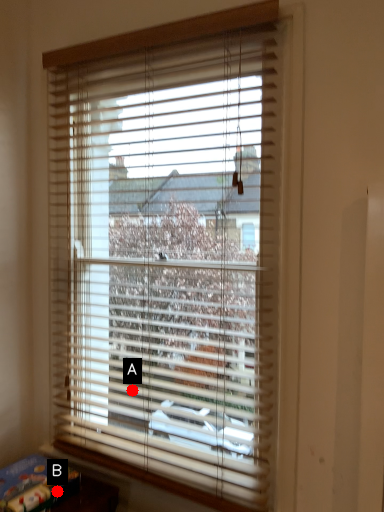
Question: Two points are circled on the image, labeled by A and B beside each circle. Which point is closer to the camera?

Choices:
 (A) A is closer
 (B) B is closer

Answer: (B)